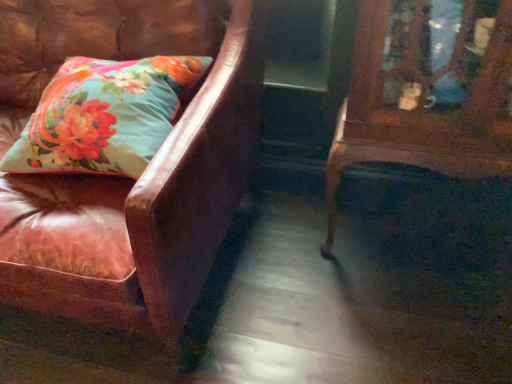
This screenshot has height=384, width=512. I want to click on vacant space that is to the left of mahogany wood side table at right, so 294,269.